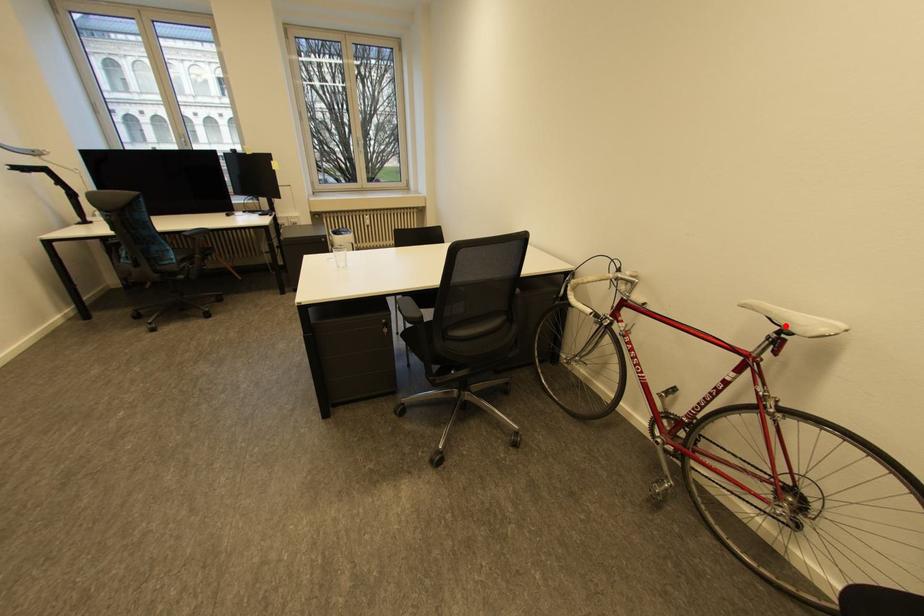
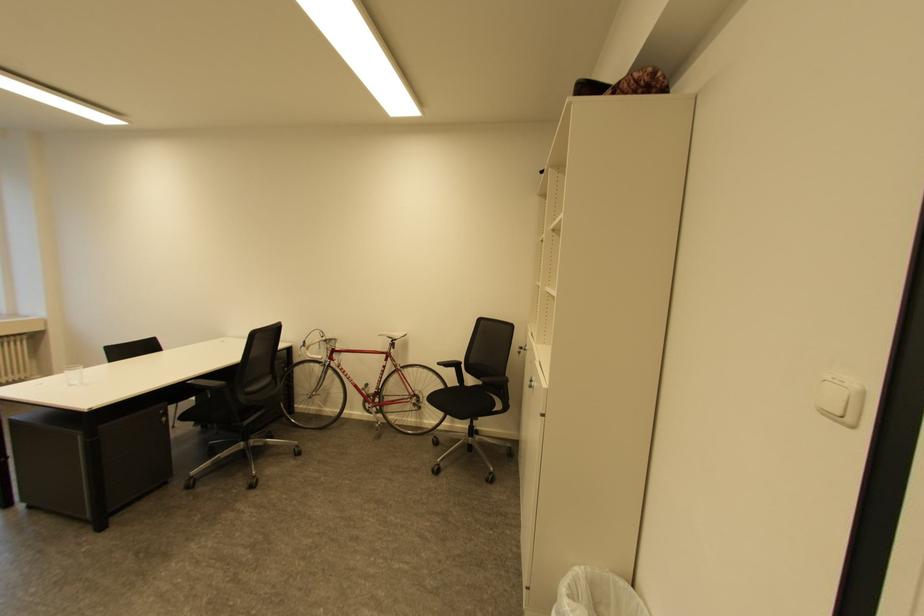
Locate, in the second image, the point that corresponds to the highlighted location in the first image.

(398, 339)